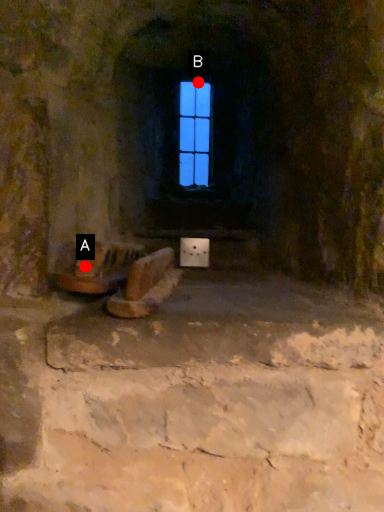
Question: Two points are circled on the image, labeled by A and B beside each circle. Which of the following is the farthest from the observer?

Choices:
 (A) A is further
 (B) B is further

Answer: (B)